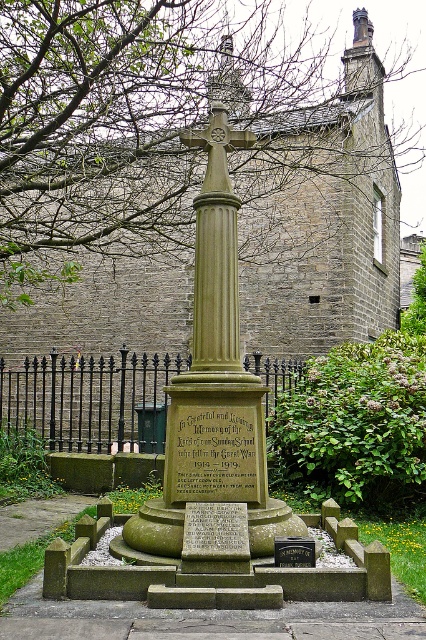
You are standing in front of the stone memorial monument and want to place a wreath at one of the two points marked on the ground. The first point is at coordinate point(175, 426) and the second is at point(302, 548). Which point is closer to you, the observer?

Point(175, 426) is closer to you than point(302, 548) because it is further to the viewer.

You are a landscape architect designing a pathway around the monument. The pathway must be wide enough to accommodate a 1.2 meter wide cart. Given the dimensions of the smooth stone cross at center and the black polished stone plaque at center, can the cart pass between them?

The smooth stone cross at center is wider than the black polished stone plaque at center. However, since both objects are positioned at the center of the monument, there is no space between them for the cart to pass through. The cart cannot navigate between them as they are centrally aligned.

You are a visitor at the memorial and want to place a bouquet of flowers between the smooth stone cross at center and the black polished stone plaque at center. Which object should you place the bouquet closer to if you want it to be more noticeable?

The smooth stone cross at center is larger in size than the black polished stone plaque at center, so placing the bouquet closer to the smooth stone cross at center would make it more noticeable.